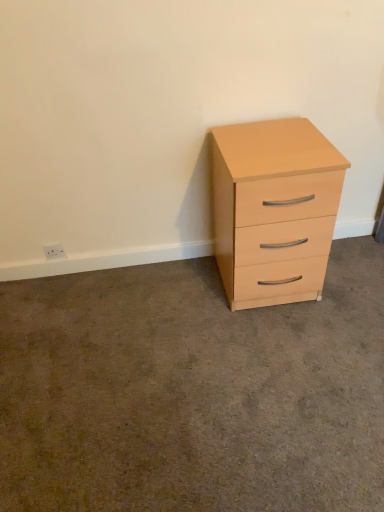
Question: Based on their positions, is white plastic electric outlet at lower left located to the left or right of matte wood chest of drawers at right?

Choices:
 (A) left
 (B) right

Answer: (A)

Question: In terms of height, does white plastic electric outlet at lower left look taller or shorter compared to matte wood chest of drawers at right?

Choices:
 (A) tall
 (B) short

Answer: (B)

Question: Which object is positioned closest to the white plastic electric outlet at lower left?

Choices:
 (A) matte wood cabinet at right
 (B) matte wood chest of drawers at right

Answer: (A)

Question: Which of these objects is positioned closest to the matte wood chest of drawers at right?

Choices:
 (A) white plastic electric outlet at lower left
 (B) matte wood cabinet at right

Answer: (B)